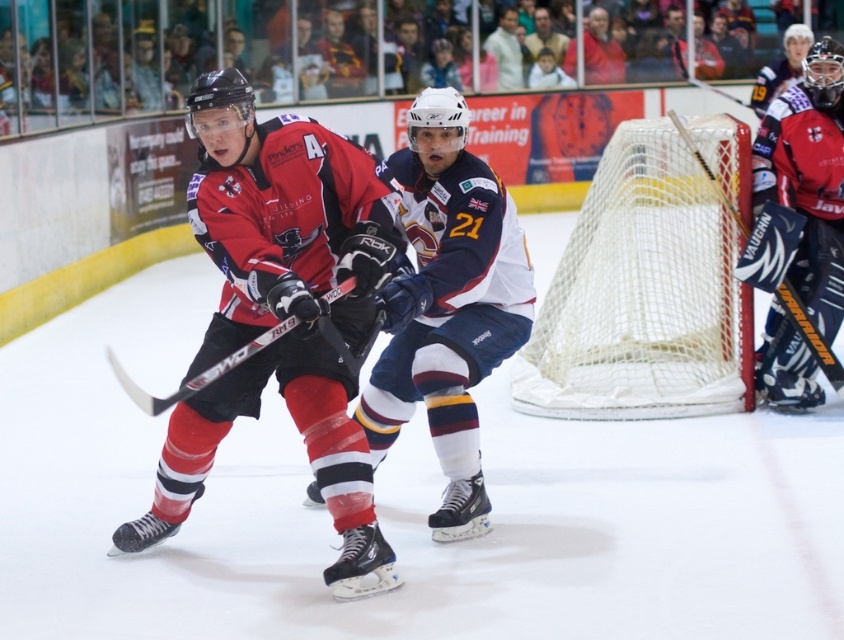
You are a referee watching the ice hockey game. You need to determine if the white jersey at center is closer to the puck than the black matte hockey stick at center. Can you confirm this?

The white jersey at center is positioned on the right side of black matte hockey stick at center, but their distance to the puck isn not specified in the description. I cannot confirm which is closer to the puck based on the given information.

You are a referee in an ice hockey game. You need to determine if the white jersey at center is closer to the puck than the black matte hockey stick at center. Can you confirm this?

The white jersey at center is 28.14 inches from black matte hockey stick at center, so the white jersey at center is not closer to the puck than the black matte hockey stick at center.

You are a referee watching an ice hockey game. You need to determine if the player wearing the matte black jersey at center has control of the puck. Based on their positions relative to the matte black hockey stick at right, can you tell if the player has control?

The matte black jersey at center is below the matte black hockey stick at right, which suggests the player is positioned lower than the stick. This could mean the stick is extended forward, indicating the player has control of the puck.